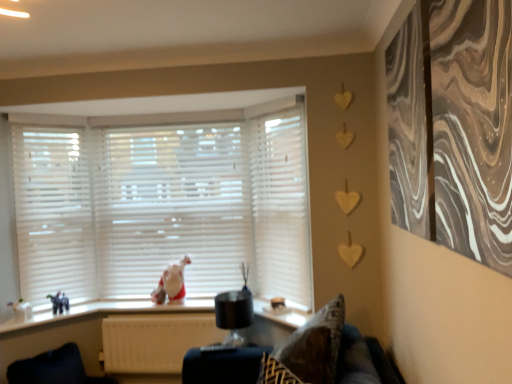
Describe the element at coordinates (155, 341) in the screenshot. This screenshot has height=384, width=512. I see `white matte radiator at lower center` at that location.

Describe the element at coordinates (453, 127) in the screenshot. Image resolution: width=512 pixels, height=384 pixels. I see `marble-patterned artwork at upper right, the 1th curtain in the front-to-back sequence` at that location.

Describe the element at coordinates (21, 310) in the screenshot. I see `white glossy vase at lower left` at that location.

Measure the distance between white plastic window sill at lower center and camera.

The distance of white plastic window sill at lower center from camera is 9.21 feet.

Where is `white plastic window sill at lower center`? white plastic window sill at lower center is located at coordinates (109, 311).

Describe the element at coordinates (280, 199) in the screenshot. The width and height of the screenshot is (512, 384). I see `white matte blinds at center, acting as the 1th curtain starting from the back` at that location.

The height and width of the screenshot is (384, 512). I want to click on white matte blinds at center, the first curtain in the left-to-right sequence, so point(280,199).

Describe the element at coordinates (315, 345) in the screenshot. The image size is (512, 384). I see `patterned fabric pillow at lower center` at that location.

What do you see at coordinates (170, 283) in the screenshot?
I see `white glossy chicken at center` at bounding box center [170, 283].

This screenshot has height=384, width=512. Find the location of `white matte radiator at lower center`. white matte radiator at lower center is located at coordinates click(x=155, y=341).

Which is in front, point (420, 205) or point (311, 373)?

The point (420, 205) is closer to the camera.

Is patterned fabric pillow at lower center at the back of marble-patterned artwork at upper right, the 1th curtain in the front-to-back sequence?

No.

Does marble-patterned artwork at upper right, placed as the 2th curtain when sorted from left to right, have a lesser width compared to patterned fabric pillow at lower center?

Yes, marble-patterned artwork at upper right, placed as the 2th curtain when sorted from left to right, is thinner than patterned fabric pillow at lower center.

Relative to patterned fabric pillow at lower center, is marble-patterned artwork at upper right, which is the 1th curtain from right to left, in front or behind?

marble-patterned artwork at upper right, which is the 1th curtain from right to left, is in front of patterned fabric pillow at lower center.

Does point (289, 133) come closer to viewer compared to point (147, 309)?

Yes, it is in front of point (147, 309).

How different are the orientations of white matte blinds at center, the second curtain positioned from the right, and white plastic window sill at lower center in degrees?

The angular difference between white matte blinds at center, the second curtain positioned from the right, and white plastic window sill at lower center is 47.1 degrees.

Consider the image. From the image's perspective, is white matte blinds at center, the first curtain in the left-to-right sequence, above white plastic window sill at lower center?

Yes.

Is white matte blinds at center, acting as the 1th curtain starting from the back, positioned beyond the bounds of white plastic window sill at lower center?

Yes, white matte blinds at center, acting as the 1th curtain starting from the back, is outside of white plastic window sill at lower center.

Would you say white glossy vase at lower left is a long distance from white matte radiator at lower center?

No.

What's the angular difference between white glossy vase at lower left and white matte radiator at lower center's facing directions?

There is a 42.6-degree angle between the facing directions of white glossy vase at lower left and white matte radiator at lower center.

From a real-world perspective, between white glossy vase at lower left and white matte radiator at lower center, who is vertically lower?

In real-world perspective, white matte radiator at lower center is lower.

From the image's perspective, between velvet dark blue swivel chair at lower left and white matte blinds at center, the second curtain viewed from the front, which one is located above?

white matte blinds at center, the second curtain viewed from the front.

You are a GUI agent. You are given a task and a screenshot of the screen. Output one action in this format:
    pyautogui.click(x=<x>, y=<y>)
    Task: Click on the swivel chair that appears on the left of white matte blinds at center, the second curtain viewed from the front
    Image resolution: width=512 pixels, height=384 pixels.
    Given the screenshot: What is the action you would take?
    pyautogui.click(x=54, y=369)

Does velvet dark blue swivel chair at lower left have a greater width compared to white matte blinds at center, acting as the 1th curtain starting from the back?

Indeed, velvet dark blue swivel chair at lower left has a greater width compared to white matte blinds at center, acting as the 1th curtain starting from the back.

Is velvet dark blue swivel chair at lower left placed right next to white matte blinds at center, the second curtain positioned from the right?

No, velvet dark blue swivel chair at lower left is not in contact with white matte blinds at center, the second curtain positioned from the right.

Can you confirm if white matte blinds at left is taller than white plastic window sill at lower center?

Yes.

From the image's perspective, is white matte blinds at left under white plastic window sill at lower center?

Actually, white matte blinds at left appears above white plastic window sill at lower center in the image.

Consider the image. In the image, is white glossy chicken at center on the left side or the right side of black glass lampshade at center?

In the image, white glossy chicken at center appears on the left side of black glass lampshade at center.

Can you confirm if white glossy chicken at center is shorter than black glass lampshade at center?

Indeed, white glossy chicken at center has a lesser height compared to black glass lampshade at center.

From the image's perspective, is white glossy chicken at center above black glass lampshade at center?

Indeed, from the image's perspective, white glossy chicken at center is shown above black glass lampshade at center.

Is white glossy chicken at center smaller than black glass lampshade at center?

Yes.

How different are the orientations of black glass lampshade at center and white matte blinds at center, the second curtain positioned from the right, in degrees?

black glass lampshade at center and white matte blinds at center, the second curtain positioned from the right, are facing 37.4 degrees away from each other.

Considering the sizes of objects black glass lampshade at center and white matte blinds at center, the first curtain in the left-to-right sequence, in the image provided, who is bigger, black glass lampshade at center or white matte blinds at center, the first curtain in the left-to-right sequence,?

Bigger between the two is white matte blinds at center, the first curtain in the left-to-right sequence.

Is black glass lampshade at center located outside white matte blinds at center, the second curtain positioned from the right?

That's correct, black glass lampshade at center is outside of white matte blinds at center, the second curtain positioned from the right.

Is black glass lampshade at center shorter than white matte blinds at center, the first curtain in the left-to-right sequence?

Indeed, black glass lampshade at center has a lesser height compared to white matte blinds at center, the first curtain in the left-to-right sequence.

Find the location of `curtain on the right of patterned fabric pillow at lower center`. curtain on the right of patterned fabric pillow at lower center is located at coordinates (453, 127).

From the image's perspective, which curtain is the 1st one above the white plastic window sill at lower center? Please provide its 2D coordinates.

[(280, 199)]

Looking at the image, which one is located closer to velvet dark blue swivel chair at lower left, white matte radiator at lower center or white matte blinds at center?

white matte radiator at lower center is closer to velvet dark blue swivel chair at lower left.

Which object lies further to the anchor point white matte blinds at center, acting as the 1th curtain starting from the back, white matte radiator at lower center or white glossy vase at lower left?

white glossy vase at lower left is further to white matte blinds at center, acting as the 1th curtain starting from the back.

When comparing their distances from white plastic window sill at lower center, does white matte blinds at center or white matte radiator at lower center seem closer?

white matte radiator at lower center is closer to white plastic window sill at lower center.

Which object lies further to the anchor point marble-patterned artwork at upper right, placed as the 2th curtain when sorted from left to right, white glossy vase at lower left or patterned fabric pillow at lower center?

Among the two, white glossy vase at lower left is located further to marble-patterned artwork at upper right, placed as the 2th curtain when sorted from left to right.

From the image, which object appears to be nearer to white matte radiator at lower center, black glass lampshade at center or white matte blinds at center, acting as the 1th curtain starting from the back?

black glass lampshade at center is closer to white matte radiator at lower center.

From the image, which object appears to be farther from white matte blinds at center, patterned fabric pillow at lower center or velvet dark blue swivel chair at lower left?

Among the two, patterned fabric pillow at lower center is located further to white matte blinds at center.

From the image, which object appears to be nearer to white glossy vase at lower left, white glossy chicken at center or white matte radiator at lower center?

Based on the image, white matte radiator at lower center appears to be nearer to white glossy vase at lower left.

Looking at the image, which one is located closer to white matte blinds at center, the second curtain positioned from the right, marble-patterned artwork at upper right, the 1th curtain in the front-to-back sequence, or white glossy vase at lower left?

Based on the image, marble-patterned artwork at upper right, the 1th curtain in the front-to-back sequence, appears to be nearer to white matte blinds at center, the second curtain positioned from the right.

Locate an element on the screen. The width and height of the screenshot is (512, 384). pillow located between marble-patterned artwork at upper right, which is the 1th curtain from right to left, and white plastic window sill at lower center in the depth direction is located at coordinates (315, 345).

You are a GUI agent. You are given a task and a screenshot of the screen. Output one action in this format:
    pyautogui.click(x=<x>, y=<y>)
    Task: Click on the radiator situated between white matte blinds at left and black glass lampshade at center from left to right
    The height and width of the screenshot is (384, 512).
    Given the screenshot: What is the action you would take?
    pyautogui.click(x=155, y=341)

Where is `window sill between marble-patterned artwork at upper right, the second curtain in the back-to-front sequence, and white matte radiator at lower center from front to back`? This screenshot has height=384, width=512. window sill between marble-patterned artwork at upper right, the second curtain in the back-to-front sequence, and white matte radiator at lower center from front to back is located at coordinates (109, 311).

This screenshot has width=512, height=384. I want to click on window sill between white matte blinds at left and white glossy chicken at center in the horizontal direction, so click(109, 311).